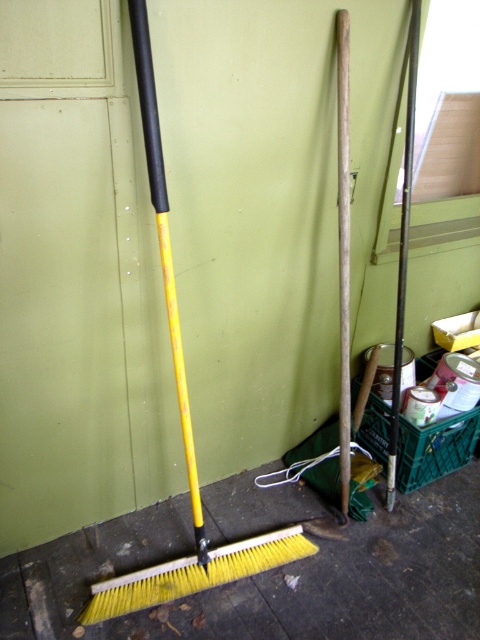
You are organizing tools in a storage area. You have a yellow plastic shovel at lower left and a yellow plastic brush at lower left. Which tool is narrower?

The yellow plastic shovel at lower left is narrower than the yellow plastic brush at lower left.

You are standing in a utility area and need to reach the yellow plastic shovel at lower left. The minimum distance required to safely operate the shovel is 4 feet. Can you safely operate it from your current position?

The distance between you and the yellow plastic shovel at lower left is 3.94 feet, which is less than the required 4 feet. Therefore, you cannot safely operate it from your current position.

Consider the image. You are organizing tools in a storage area. You have a yellow plastic shovel at lower left and a smooth wood pole at center. Which tool takes up more space?

The yellow plastic shovel at lower left is larger in size than the smooth wood pole at center, so it takes up more space.